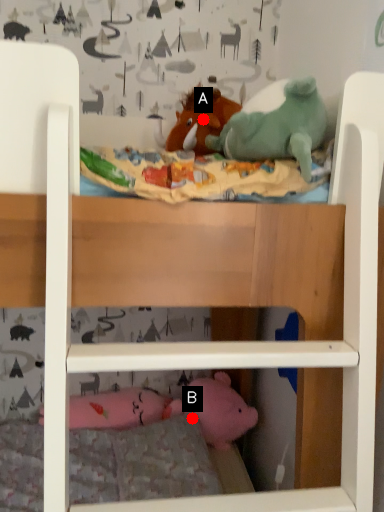
Question: Two points are circled on the image, labeled by A and B beside each circle. Which point is closer to the camera?

Choices:
 (A) A is closer
 (B) B is closer

Answer: (A)